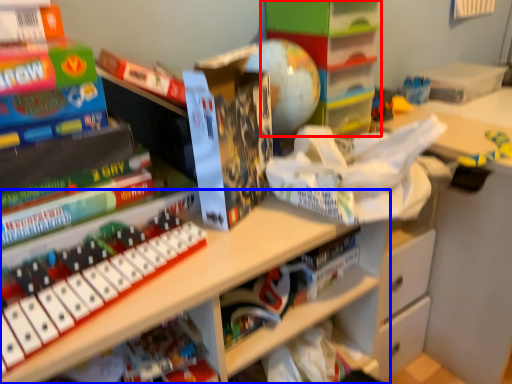
Question: Among these objects, which one is farthest to the camera, shelf (highlighted by a red box) or shelf (highlighted by a blue box)?

Choices:
 (A) shelf
 (B) shelf

Answer: (A)